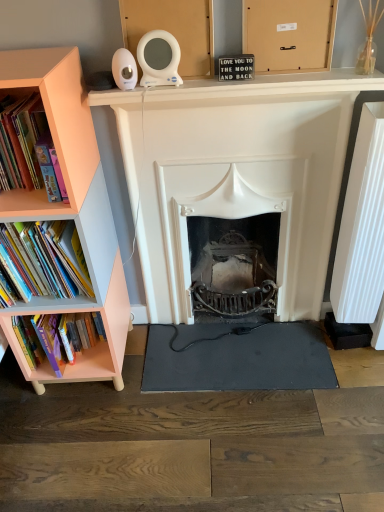
Question: Is pink matte bookshelf at left spatially inside peach wood bookshelf at left, or outside of it?

Choices:
 (A) inside
 (B) outside

Answer: (B)

Question: Considering the positions of pink matte bookshelf at left and peach wood bookshelf at left in the image, is pink matte bookshelf at left taller or shorter than peach wood bookshelf at left?

Choices:
 (A) tall
 (B) short

Answer: (A)

Question: Which object is the farthest from the pink matte bookshelf at left?

Choices:
 (A) white matte fireplace at center
 (B) hardcover books at left
 (C) peach wood bookcase at left
 (D) peach wood bookshelf at left
 (E) black rubber yoga mat at center

Answer: (E)

Question: Which object is positioned farthest from the peach wood bookshelf at left?

Choices:
 (A) matte cardboard box at upper center
 (B) black rubber yoga mat at center
 (C) white matte fireplace at center
 (D) peach wood bookcase at left
 (E) hardcover books at left

Answer: (A)